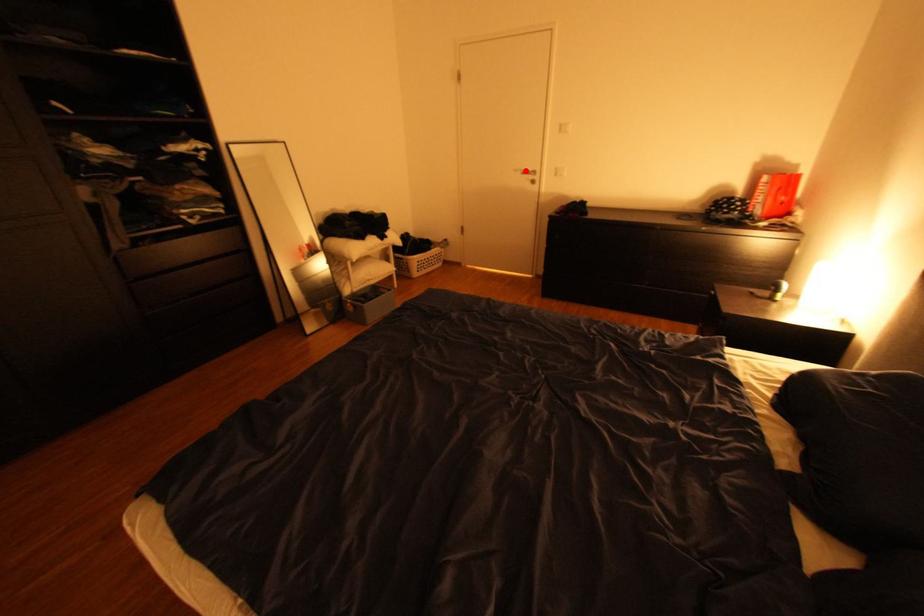
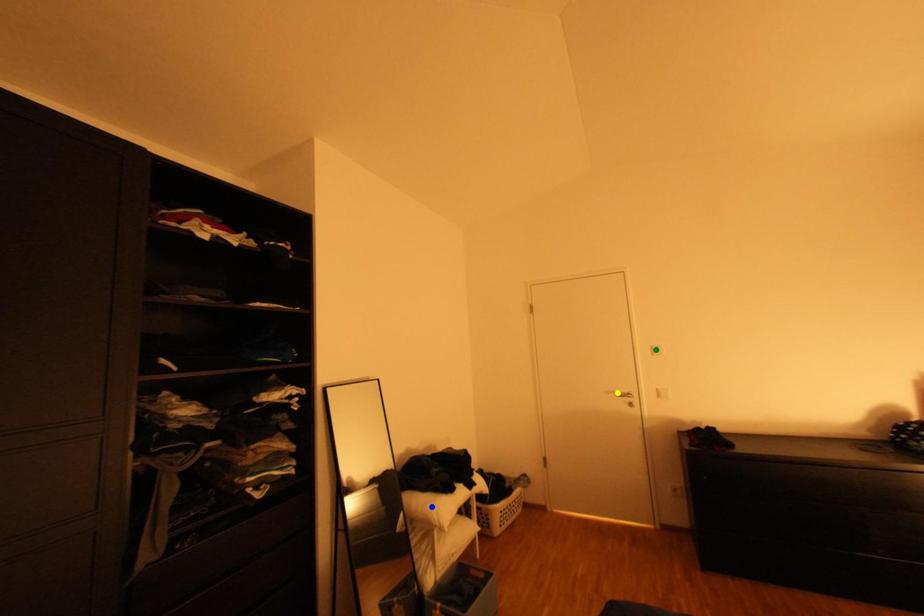
Question: I am providing you with two images of the same scene from different viewpoints. A red point is marked on the first image. You are given multiple points on the second image. In image 2, which mark is for the same physical point as the one in image 1?

Choices:
 (A) green point
 (B) yellow point
 (C) blue point

Answer: (B)